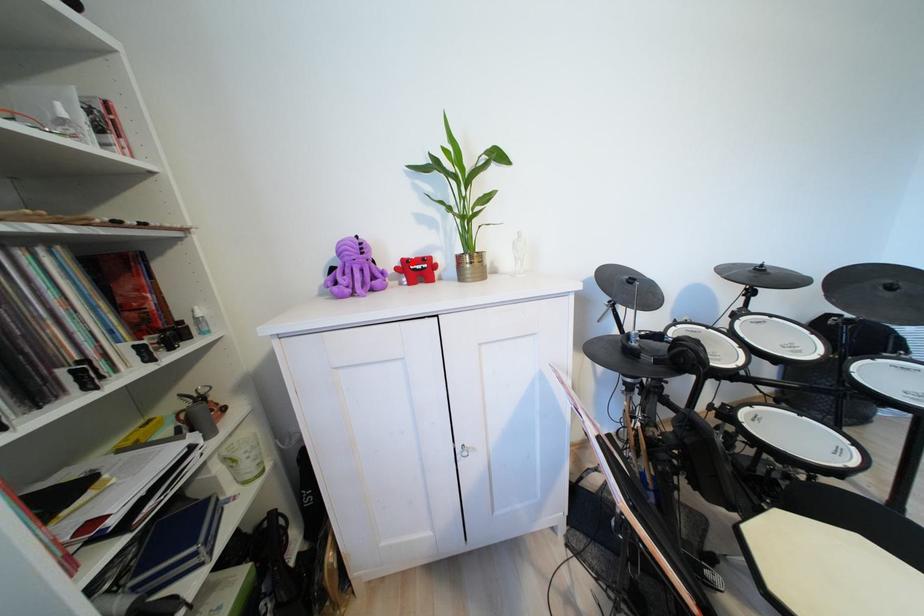
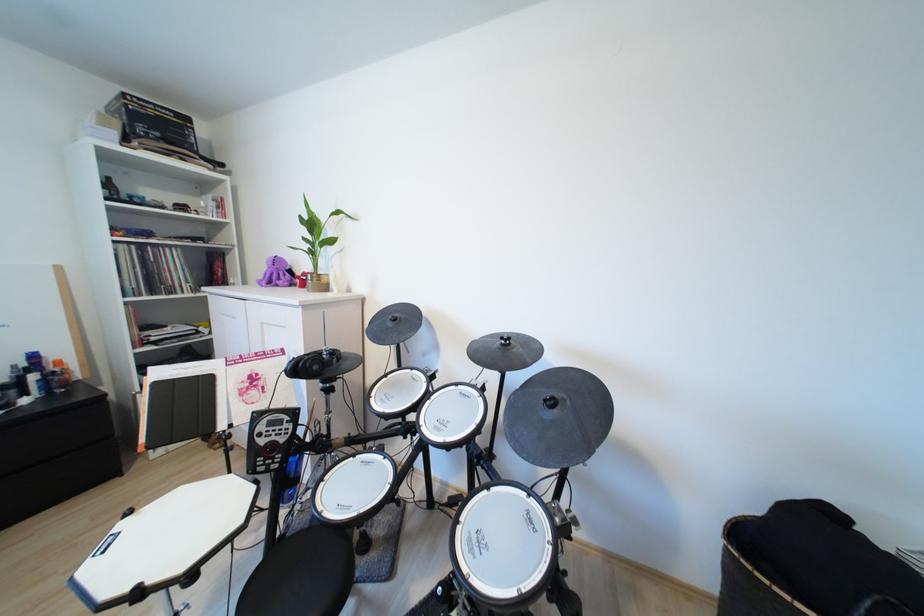
Where in the second image is the point corresponding to the highlighted location from the first image?

(310, 275)